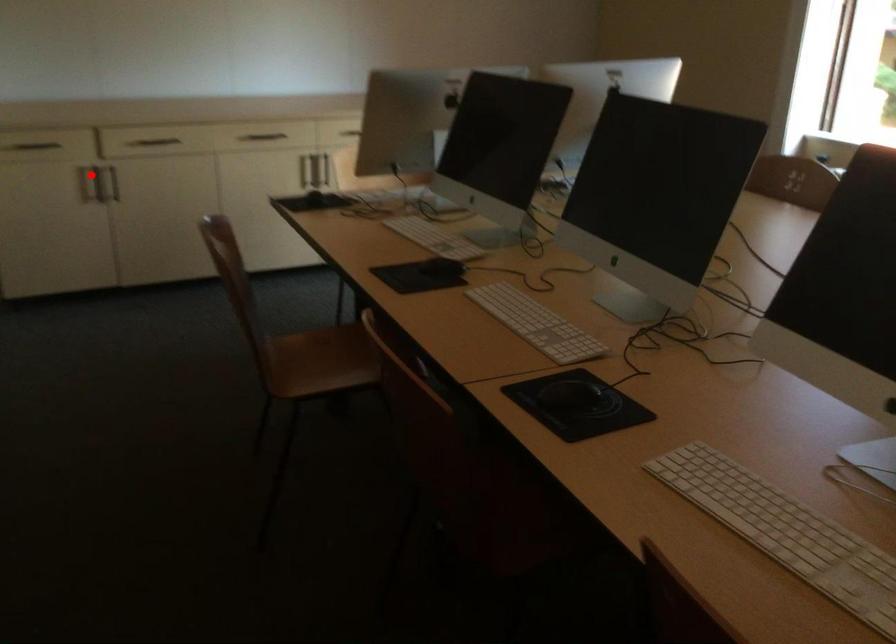
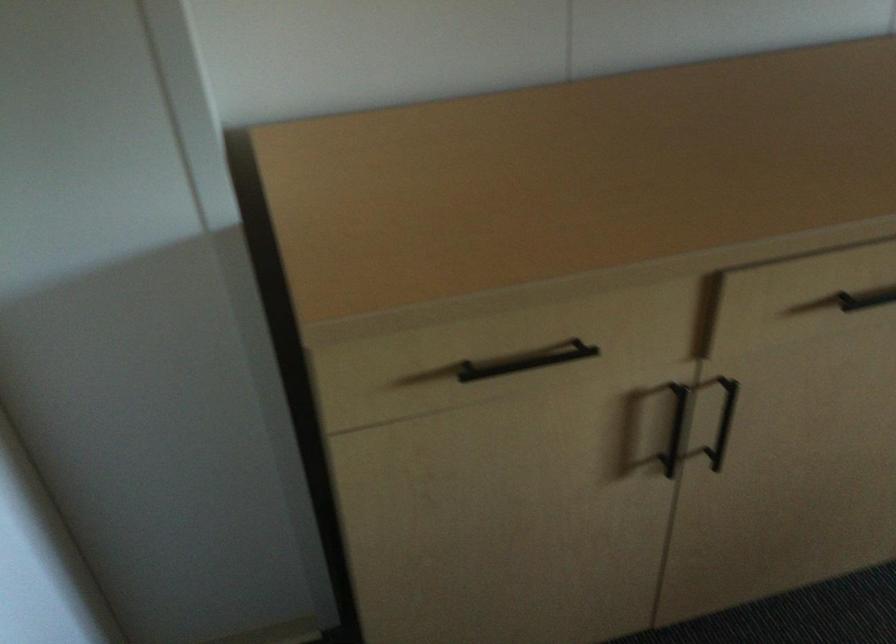
Where in the second image is the point corresponding to the highlighted location from the first image?

(675, 428)